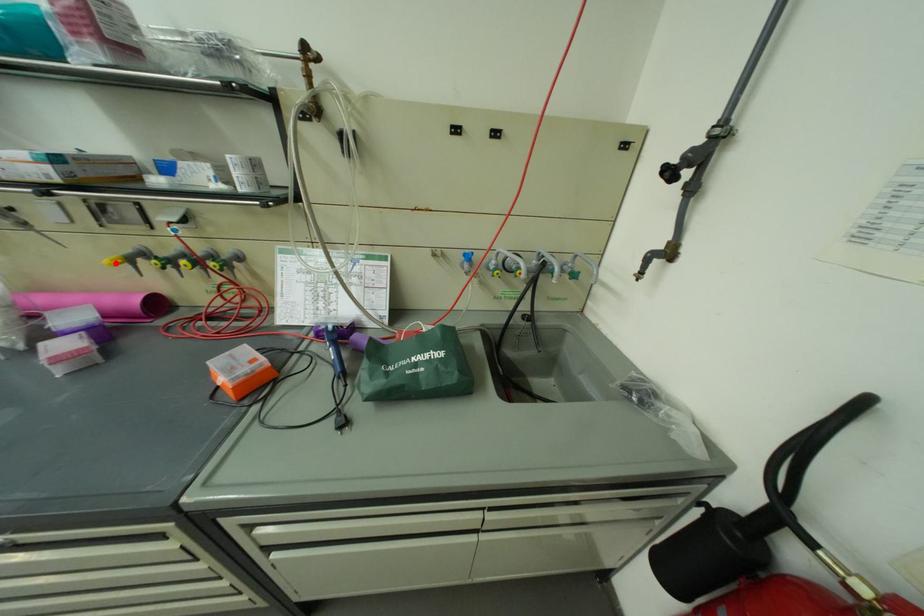
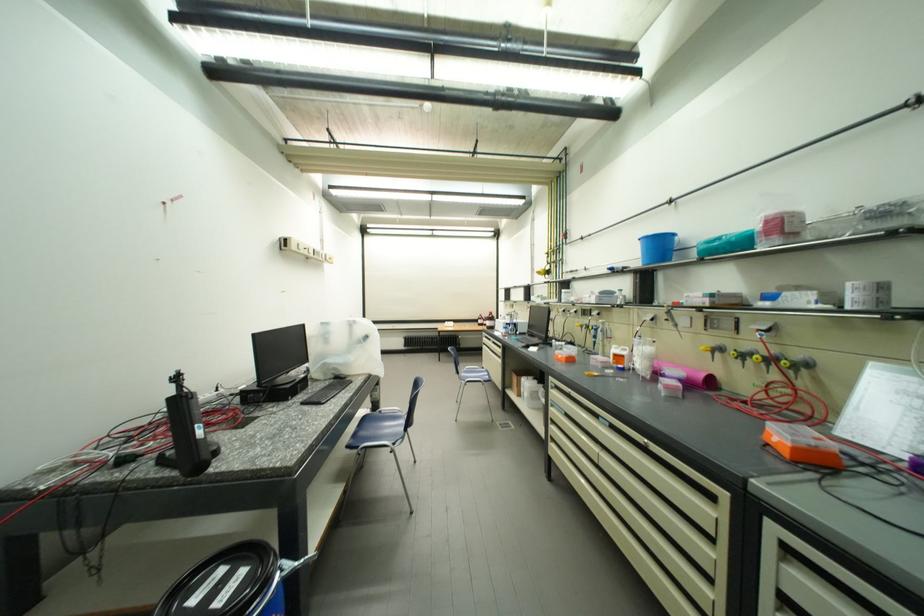
Question: I am providing you with two images of the same scene from different viewpoints. A red point is marked on the first image. Is the red point's position out of view in image 2?

Choices:
 (A) Yes
 (B) No

Answer: (B)